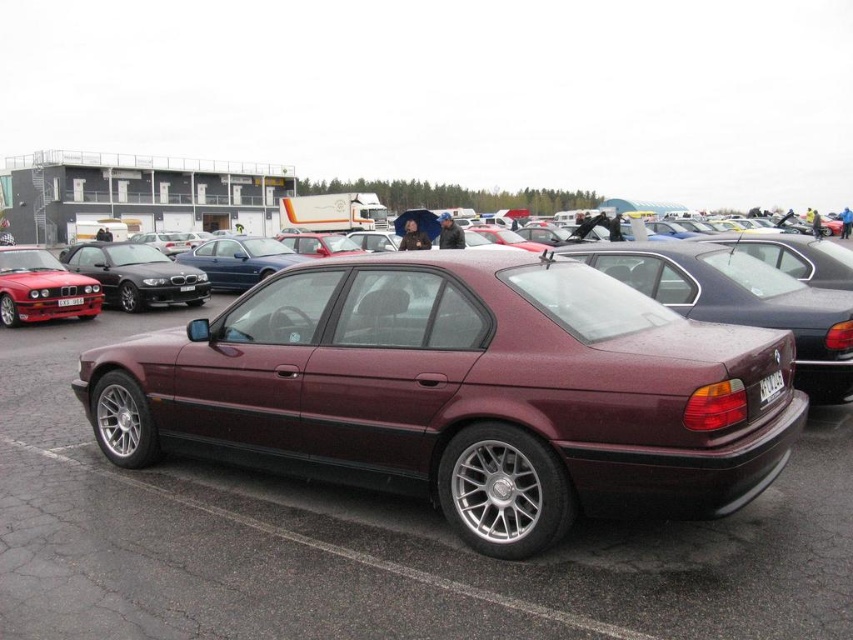
You are a delivery person trying to park your van in the parking lot. You see the satin black car at left and the black plastic license plate at center. Which object is higher in the image?

The satin black car at left is taller than the black plastic license plate at center.

You are a delivery person needing to place a package between the satin black car at left and the black plastic license plate at center. The package requires 2 meters of space. Is there enough space?

The satin black car at left and the black plastic license plate at center are 2.14 meters apart, so yes, there is enough space for the package requiring 2 meters of space.

You are a delivery person trying to navigate through the parking lot. You see the satin black car at left and the white plastic license plate at rear. Which object is closer to you?

The satin black car at left is closer to you because it is positioned further to the viewer than the white plastic license plate at rear.